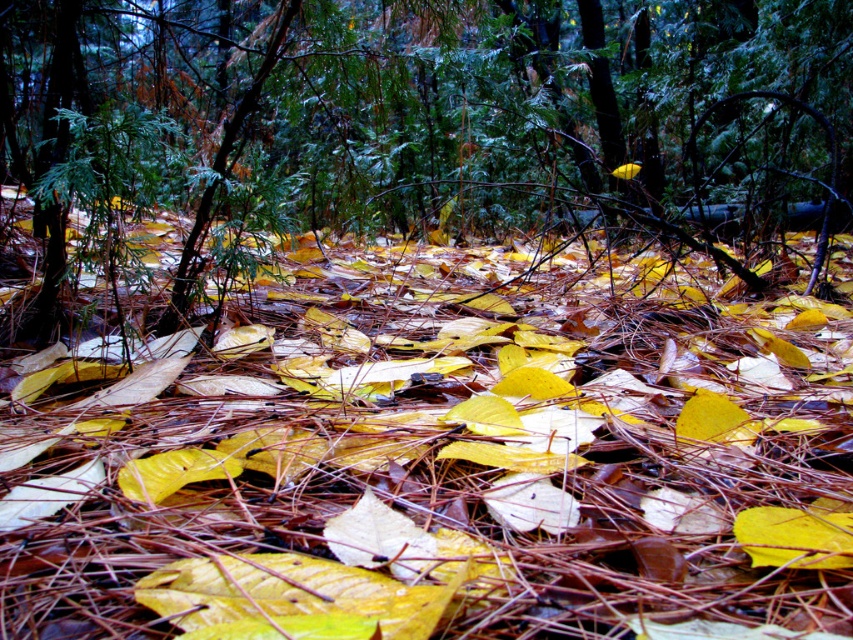
Question: Which point appears farthest from the camera in this image?

Choices:
 (A) (498, 634)
 (B) (776, 90)

Answer: (B)

Question: Can you confirm if yellow matte leaves at center is positioned below green textured pine tree at center?

Choices:
 (A) no
 (B) yes

Answer: (B)

Question: Which point is farther to the camera?

Choices:
 (A) (19, 541)
 (B) (312, 118)

Answer: (B)

Question: Considering the relative positions of yellow matte leaves at center and green textured pine tree at center in the image provided, where is yellow matte leaves at center located with respect to green textured pine tree at center?

Choices:
 (A) below
 (B) above

Answer: (A)

Question: Is yellow matte leaves at center above green textured pine tree at center?

Choices:
 (A) no
 (B) yes

Answer: (A)